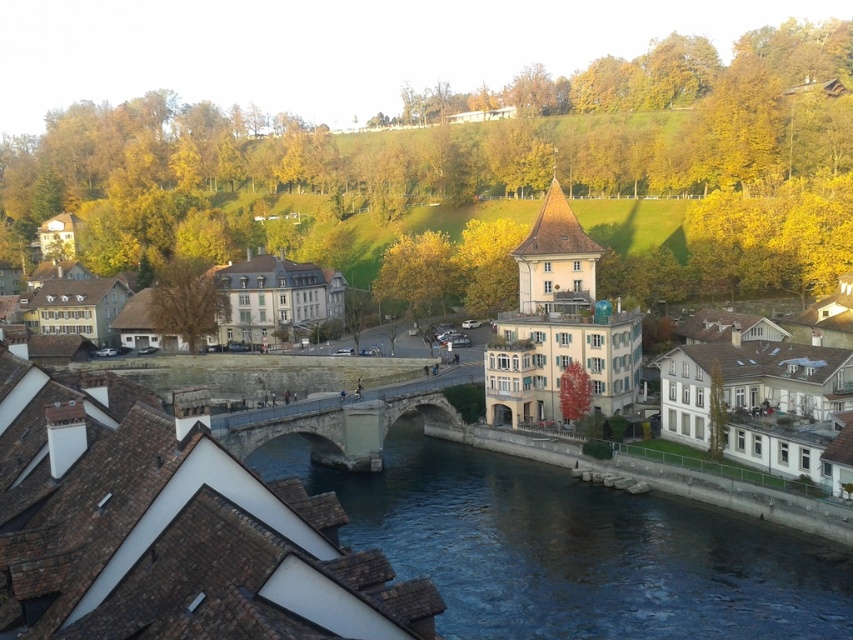
Question: Where is blue stone bridge at center located in relation to stone bridge at center in the image?

Choices:
 (A) below
 (B) above

Answer: (A)

Question: Does blue stone bridge at center appear on the left side of stone bridge at center?

Choices:
 (A) no
 (B) yes

Answer: (A)

Question: Does blue stone bridge at center appear on the right side of stone bridge at center?

Choices:
 (A) no
 (B) yes

Answer: (B)